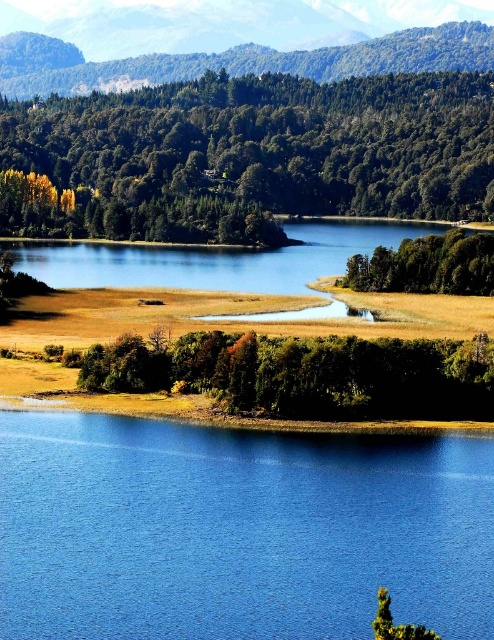
Question: Which point is closer to the camera?

Choices:
 (A) (259, 144)
 (B) (139, 618)
 (C) (449, 284)
 (D) (225, 52)

Answer: (B)

Question: In this image, where is green forested mountain at upper center located relative to green matte tree at center-right?

Choices:
 (A) above
 (B) below

Answer: (A)

Question: Considering the relative positions of blue smooth water at lower center and green matte trees at upper center in the image provided, where is blue smooth water at lower center located with respect to green matte trees at upper center?

Choices:
 (A) left
 (B) right

Answer: (B)

Question: Is blue smooth water at lower center below green forested mountain at upper center?

Choices:
 (A) no
 (B) yes

Answer: (B)

Question: Considering the real-world distances, which object is closest to the green forested mountain at upper center?

Choices:
 (A) green leafy trees at center
 (B) green matte tree at center-right
 (C) blue smooth water at lower center
 (D) green matte trees at upper center

Answer: (D)

Question: Considering the real-world distances, which object is farthest from the green forested mountain at upper center?

Choices:
 (A) green matte tree at center-right
 (B) green matte trees at upper center
 (C) blue smooth water at lower center
 (D) green leafy trees at center

Answer: (C)